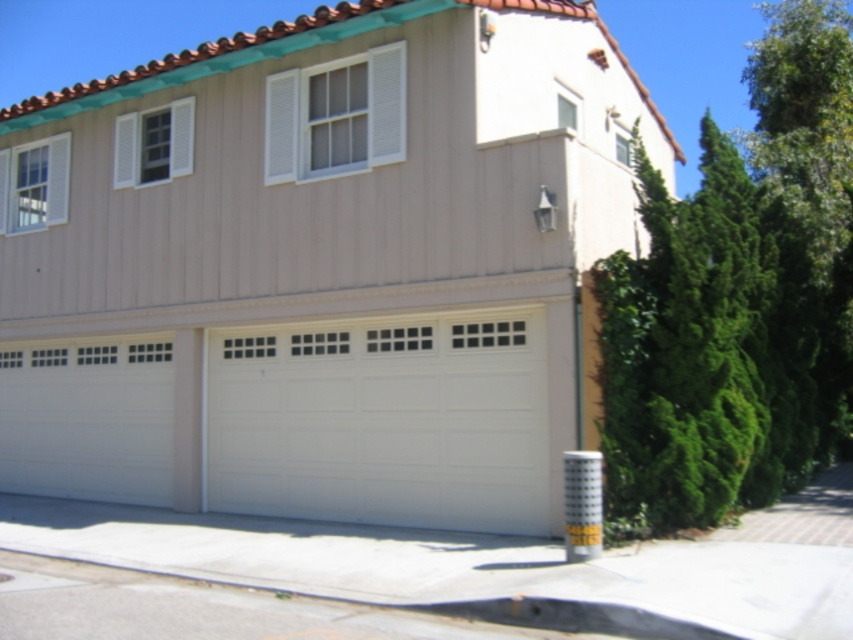
You are standing in front of the house and want to place a new mailbox between the green leafy tree at right and the white painted wood garage door at center. Based on their positions, which side of the garage door should the mailbox be placed on?

The green leafy tree at right is positioned on the right side of white painted wood garage door at center, so the mailbox should be placed on the right side of the white painted wood garage door at center to be between them.

You are standing in front of the two garage doors shown in the image. Which garage door, the white smooth garage door at center or the white painted wood garage door at center, is positioned closer to you?

The white smooth garage door at center is closer to the viewer than the white painted wood garage door at center.